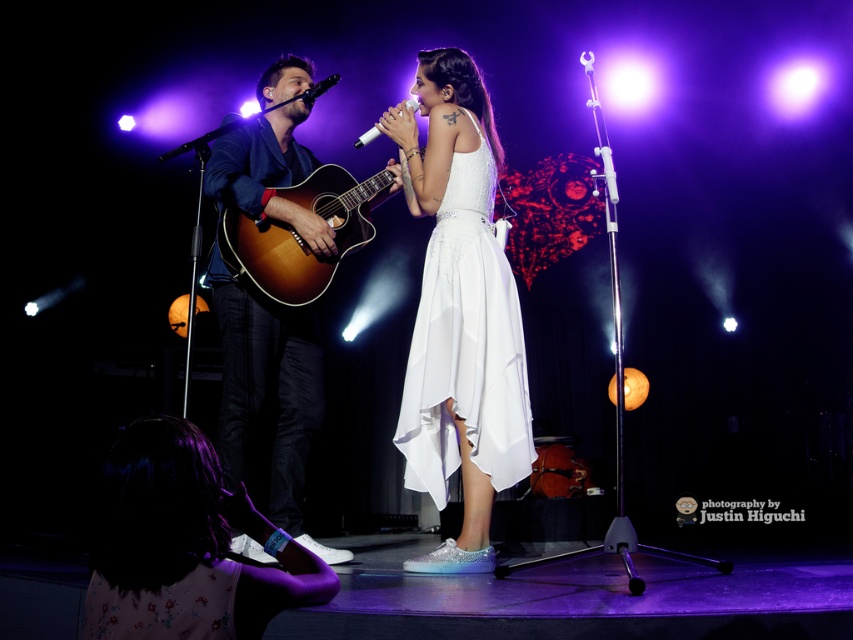
Question: Which of the following is the closest to the observer?

Choices:
 (A) white satin dress at center
 (B) black matte microphone at upper center
 (C) wooden acoustic guitar at center

Answer: (A)

Question: Is wooden acoustic guitar at center behind white plastic microphone at center?

Choices:
 (A) yes
 (B) no

Answer: (B)

Question: Which of the following is the farthest from the observer?

Choices:
 (A) matte brown acoustic guitar at center
 (B) wooden acoustic guitar at center

Answer: (B)

Question: Does matte brown acoustic guitar at center come behind white satin dress at center?

Choices:
 (A) no
 (B) yes

Answer: (B)

Question: Does white satin dress at center have a larger size compared to black matte microphone at upper center?

Choices:
 (A) yes
 (B) no

Answer: (A)

Question: Which object is the farthest from the white satin dress at lower left?

Choices:
 (A) white satin dress at center
 (B) white plastic microphone at center
 (C) matte brown acoustic guitar at center

Answer: (B)